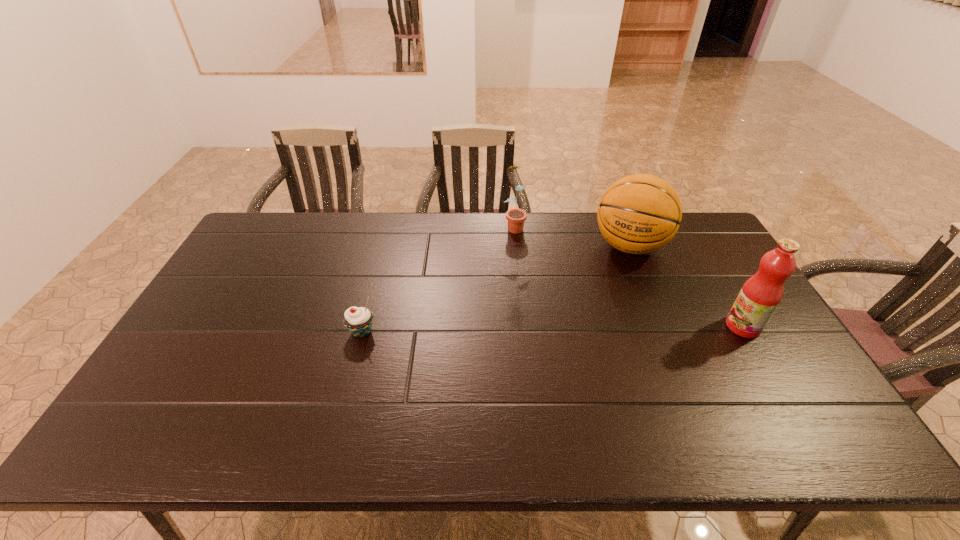
Identify the location of vacant space located 0.270m on the flower of the sunflower. (540, 286).

In order to click on vacant space situated 0.390m on the flower of the sunflower in this screenshot , I will do `click(553, 313)`.

Identify the location of free space located on the surface of the third object from left to right near the brand logo. point(616,284).

Image resolution: width=960 pixels, height=540 pixels. Find the location of `vacant space located 0.380m on the surface of the third object from left to right near the brand logo`. vacant space located 0.380m on the surface of the third object from left to right near the brand logo is located at coordinates (593, 353).

I want to click on vacant space situated 0.110m on the surface of the third object from left to right near the brand logo, so click(614, 289).

Find the location of `sunflower that is at the far edge`. sunflower that is at the far edge is located at coordinates (516, 217).

Where is `basketball present at the far edge`? basketball present at the far edge is located at coordinates (638, 214).

Identify the location of object at the right edge. (760, 295).

Identify the location of free location at the far edge of the desktop. This screenshot has width=960, height=540. (291, 247).

This screenshot has height=540, width=960. In the image, there is a desktop. In order to click on free space at the near edge in this screenshot , I will do `click(328, 383)`.